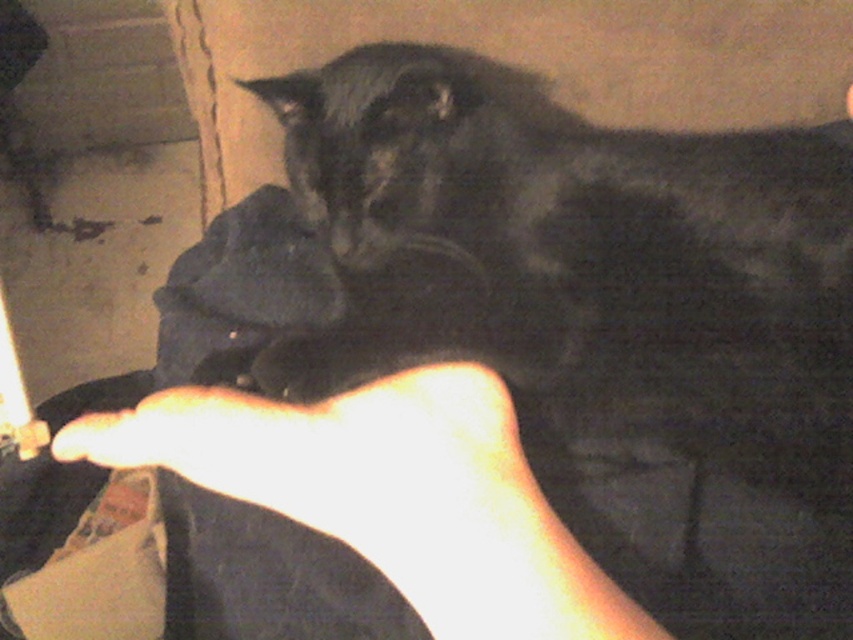
You are a photographer trying to capture the black fur cat at center without the light skin tone flesh at lower center blocking the view. Can you move your camera position to fully frame the cat?

The black fur cat at center is larger than the light skin tone flesh at lower center, so moving the camera position might allow you to frame the cat while avoiding the obstruction from the light skin tone flesh at lower center.

You are taking a photo of the black fur cat at center and the light skin tone flesh at lower center. Which object is taller in the image?

The black fur cat at center has a greater height compared to the light skin tone flesh at lower center, so the black fur cat at center is taller.